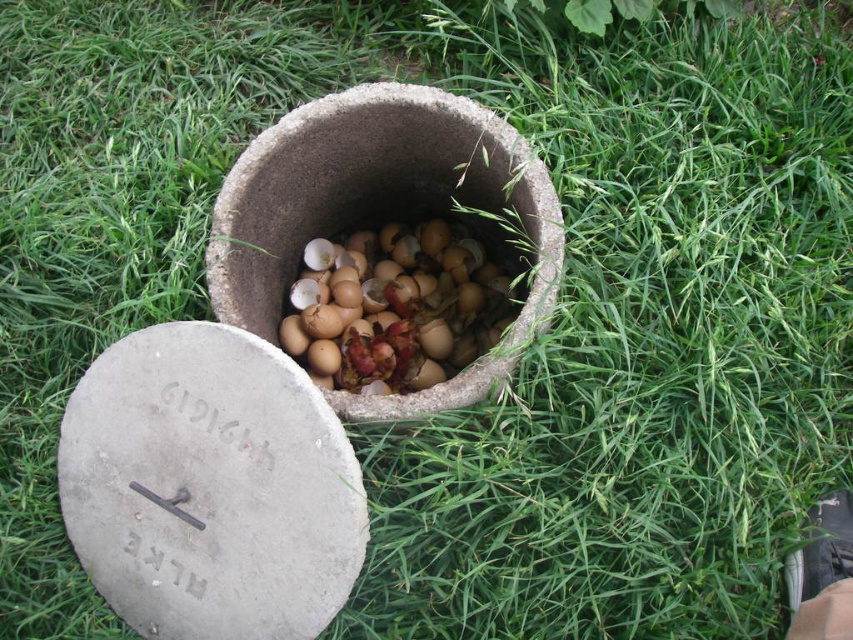
Is gray concrete lid at center taller than brown matte eggshells at center?

Correct, gray concrete lid at center is much taller as brown matte eggshells at center.

Who is more forward, [76,552] or [424,246]?

Positioned in front is point [76,552].

Who is more distant from viewer, [228,396] or [471,314]?

The point [471,314] is more distant.

The height and width of the screenshot is (640, 853). Identify the location of gray concrete lid at center. (209, 486).